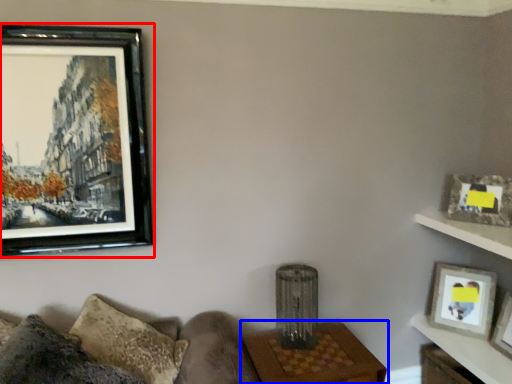
Question: Which of the following is the closest to the observer, picture frame (highlighted by a red box) or table (highlighted by a blue box)?

Choices:
 (A) picture frame
 (B) table

Answer: (A)